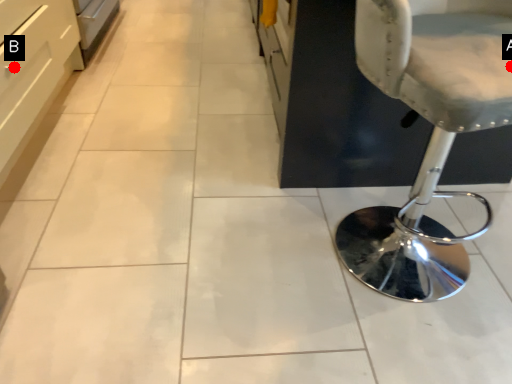
Question: Two points are circled on the image, labeled by A and B beside each circle. Which point is closer to the camera?

Choices:
 (A) A is closer
 (B) B is closer

Answer: (A)